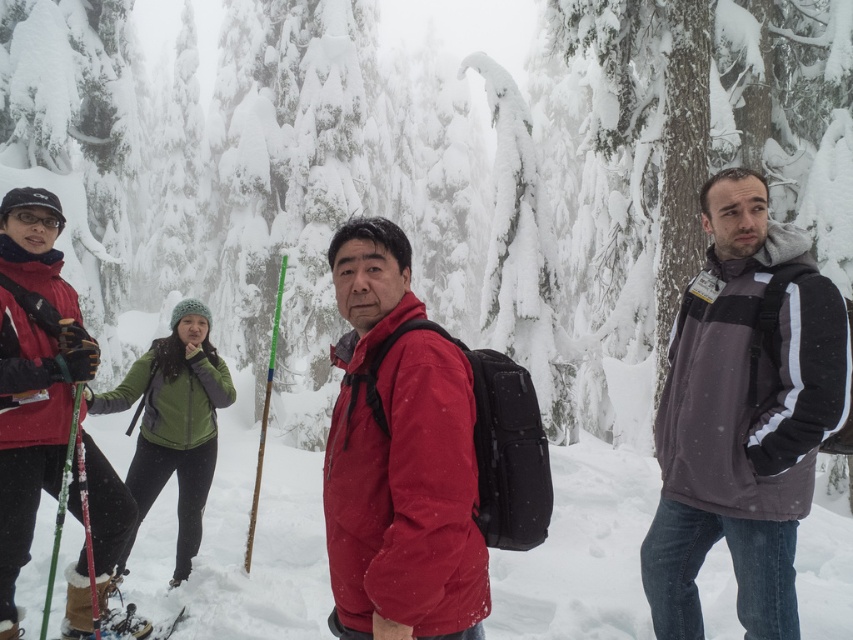
Can you confirm if matte red jacket at center is positioned to the left of matte red jacket at left?

No, matte red jacket at center is not to the left of matte red jacket at left.

Does point (383, 497) come in front of point (10, 390)?

Yes.

Image resolution: width=853 pixels, height=640 pixels. I want to click on matte red jacket at center, so click(x=398, y=460).

Who is lower down, snow-covered tree at center or matte red jacket at left?

matte red jacket at left is below.

Does point (579, 140) come in front of point (59, 396)?

No, (579, 140) is behind (59, 396).

Which is behind, point (289, 317) or point (10, 456)?

Point (289, 317)

Find the location of a particular element. The height and width of the screenshot is (640, 853). snow-covered tree at center is located at coordinates (425, 177).

Between dark gray fleece jacket at center and matte red jacket at center, which one has less height?

With less height is matte red jacket at center.

Between point (757, 419) and point (350, 362), which one is positioned in front?

Point (350, 362) is more forward.

Does point (804, 417) come behind point (399, 563)?

Yes, it is behind point (399, 563).

Locate an element on the screen. dark gray fleece jacket at center is located at coordinates (741, 416).